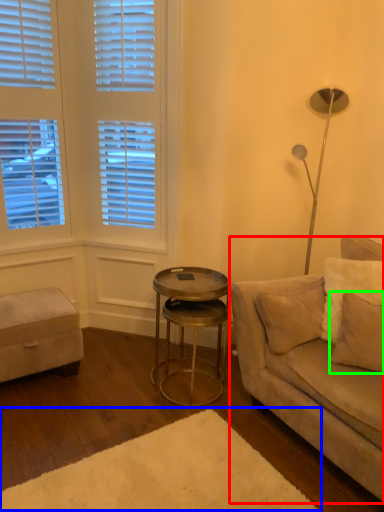
Question: Considering the real-world distances, which object is closest to studio couch (highlighted by a red box)? plain (highlighted by a blue box) or pillow (highlighted by a green box).

Choices:
 (A) plain
 (B) pillow

Answer: (B)